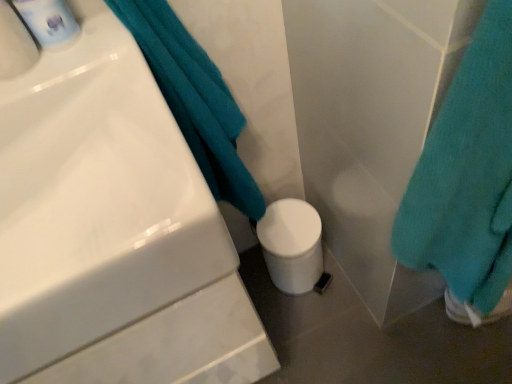
This screenshot has height=384, width=512. What are the coordinates of `vacant area that is in front of white glossy mouthwash at upper left` in the screenshot? It's located at (82, 78).